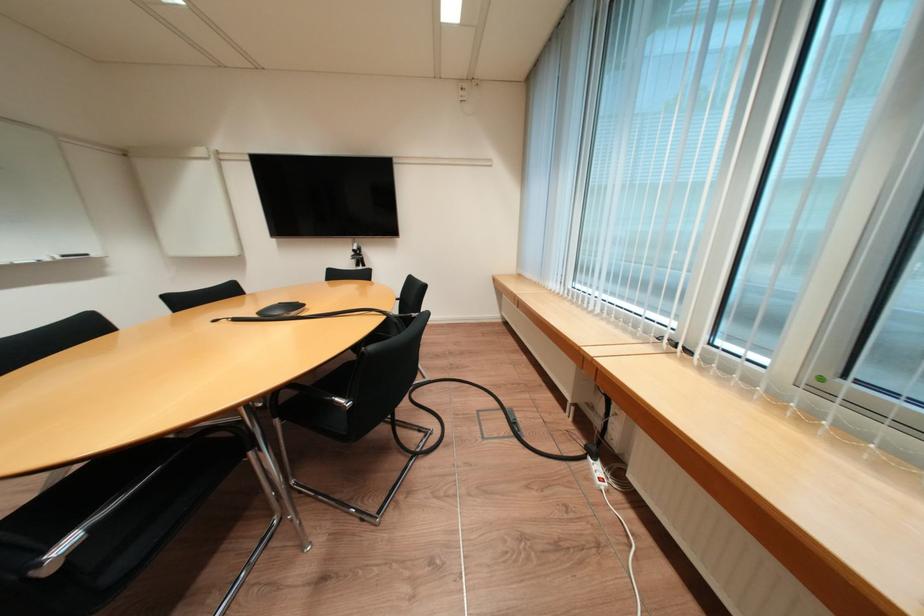
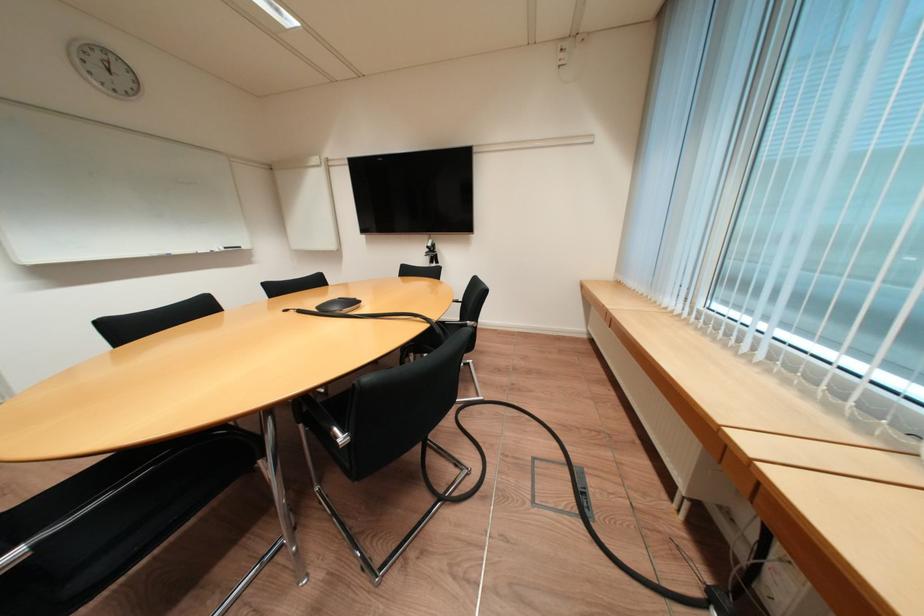
Question: The camera is either moving clockwise (left) or counter-clockwise (right) around the object. The first image is from the beginning of the video and the second image is from the end. Is the camera moving left or right when shooting the video?

Choices:
 (A) Left
 (B) Right

Answer: (B)